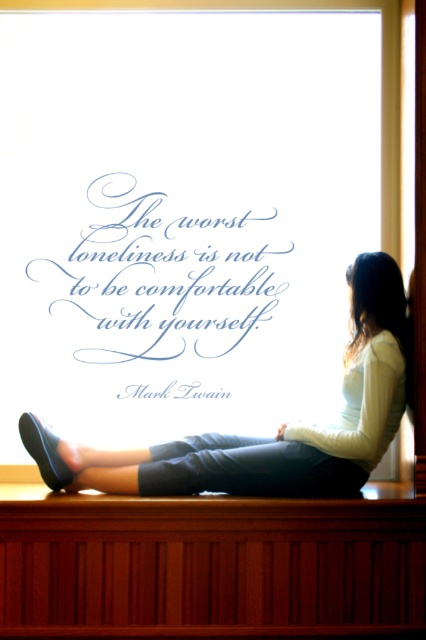
Does wooden ledge at lower center appear over light beige sweater at lower right?

Actually, wooden ledge at lower center is below light beige sweater at lower right.

Locate an element on the screen. Image resolution: width=426 pixels, height=640 pixels. wooden ledge at lower center is located at coordinates (210, 564).